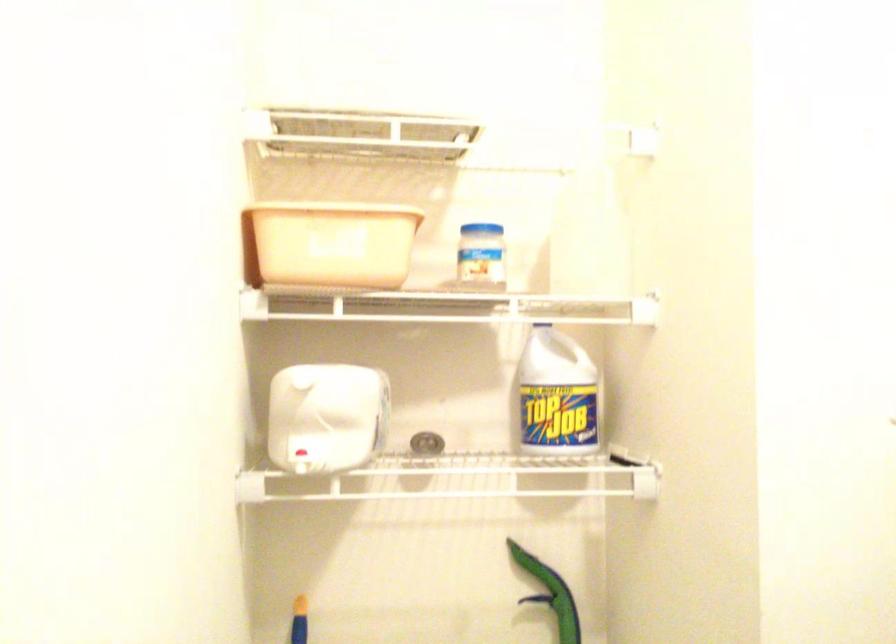
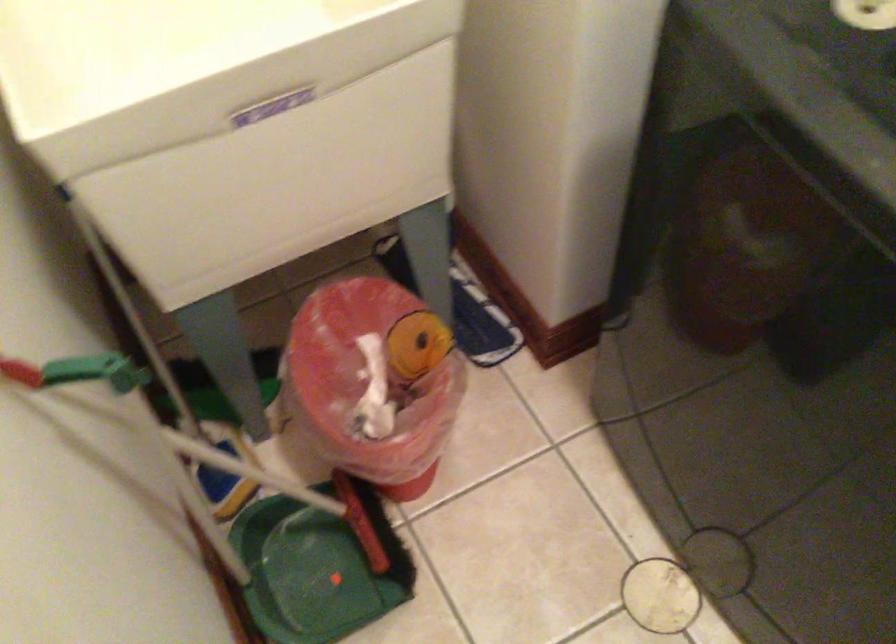
Consider the image. The first image is from the beginning of the video and the second image is from the end. How did the camera likely rotate when shooting the video?

The camera's rotation is toward right-down.